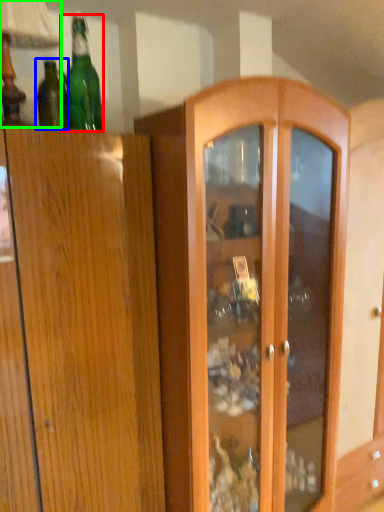
Question: Based on their relative distances, which object is farther from bottle (highlighted by a red box)? Choose from bottle (highlighted by a blue box) and table lamp (highlighted by a green box).

Choices:
 (A) bottle
 (B) table lamp

Answer: (B)